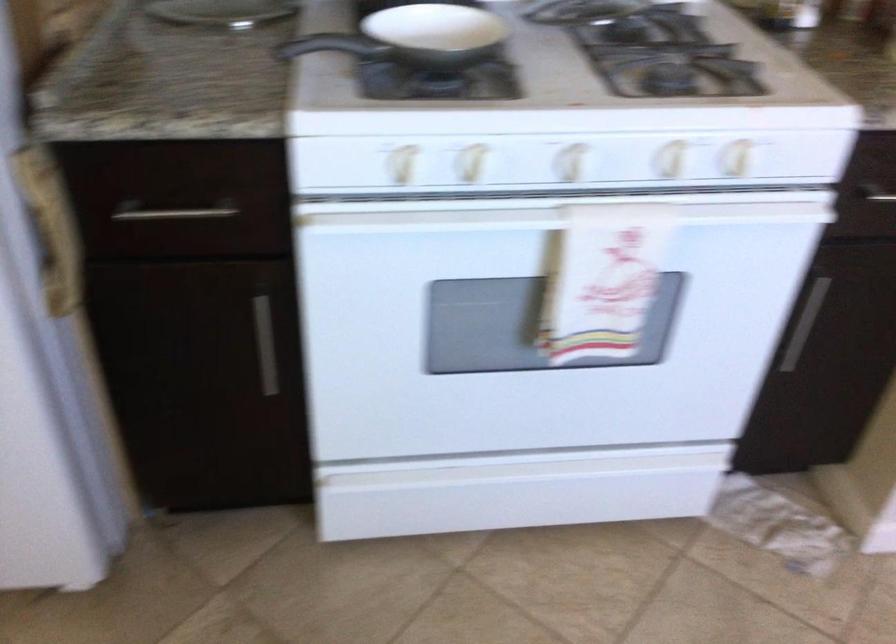
Image resolution: width=896 pixels, height=644 pixels. I want to click on silver drawer handle, so click(x=173, y=213).